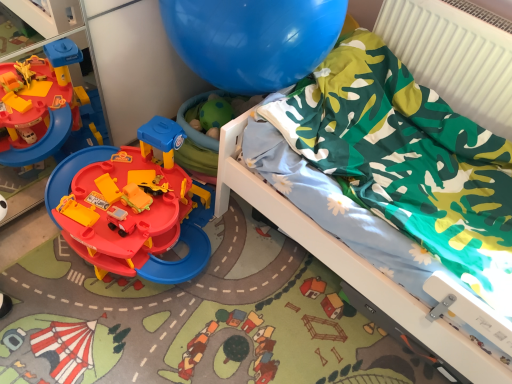
The image size is (512, 384). What do you see at coordinates (453, 58) in the screenshot?
I see `green fabric at upper right` at bounding box center [453, 58].

Image resolution: width=512 pixels, height=384 pixels. In order to click on green fabric at upper right in this screenshot , I will do coord(453,58).

Describe the element at coordinates (348, 262) in the screenshot. The height and width of the screenshot is (384, 512). I see `green camouflage fabric at upper right` at that location.

Measure the distance between green camouflage fabric at upper right and camera.

The depth of green camouflage fabric at upper right is 96.71 centimeters.

Locate an element on the screen. green camouflage fabric at upper right is located at coordinates (348, 262).

Where is `green fabric at upper right`? green fabric at upper right is located at coordinates (453, 58).

Which object is positioned more to the right, green camouflage fabric at upper right or green fabric at upper right?

green fabric at upper right is more to the right.

Which object is further away from the camera, green camouflage fabric at upper right or green fabric at upper right?

green fabric at upper right is more distant.

Considering the points (484, 376) and (429, 29), which point is in front, point (484, 376) or point (429, 29)?

The point (484, 376) is closer.

From the image's perspective, is green camouflage fabric at upper right beneath green fabric at upper right?

Yes, from the image's perspective, green camouflage fabric at upper right is beneath green fabric at upper right.

From a real-world perspective, is green camouflage fabric at upper right below green fabric at upper right?

Correct, in the physical world, green camouflage fabric at upper right is lower than green fabric at upper right.

Is green camouflage fabric at upper right wider than green fabric at upper right?

Correct, the width of green camouflage fabric at upper right exceeds that of green fabric at upper right.

From their relative heights in the image, would you say green camouflage fabric at upper right is taller or shorter than green fabric at upper right?

In the image, green camouflage fabric at upper right appears to be taller than green fabric at upper right.

Based on their sizes in the image, would you say green camouflage fabric at upper right is bigger or smaller than green fabric at upper right?

In the image, green camouflage fabric at upper right appears to be larger than green fabric at upper right.

Is green camouflage fabric at upper right situated inside green fabric at upper right or outside?

green camouflage fabric at upper right exists outside the volume of green fabric at upper right.

Is green camouflage fabric at upper right far away from green fabric at upper right?

No, there isn't a large distance between green camouflage fabric at upper right and green fabric at upper right.

Looking at this image, is green camouflage fabric at upper right oriented away from green fabric at upper right?

green camouflage fabric at upper right does not have its back to green fabric at upper right.

How different are the orientations of green camouflage fabric at upper right and green fabric at upper right in degrees?

The facing directions of green camouflage fabric at upper right and green fabric at upper right are 90 degrees apart.

How much distance is there between green camouflage fabric at upper right and green fabric at upper right?

28.84 inches.

The height and width of the screenshot is (384, 512). What are the coordinates of `radiator positioned vertically above the green camouflage fabric at upper right (from a real-world perspective)` in the screenshot? It's located at (453, 58).

Between green fabric at upper right and green camouflage fabric at upper right, which one appears on the left side from the viewer's perspective?

green camouflage fabric at upper right is more to the left.

In the image, is green fabric at upper right positioned in front of or behind green camouflage fabric at upper right?

Clearly, green fabric at upper right is behind green camouflage fabric at upper right.

Is point (510, 54) more distant than point (392, 281)?

Yes, point (510, 54) is farther from viewer.

From the image's perspective, does green fabric at upper right appear lower than green camouflage fabric at upper right?

No.

From a real-world perspective, who is located lower, green fabric at upper right or green camouflage fabric at upper right?

green camouflage fabric at upper right, from a real-world perspective.

Which object is wider, green fabric at upper right or green camouflage fabric at upper right?

green camouflage fabric at upper right is wider.

Based on the photo, can you confirm if green fabric at upper right is shorter than green camouflage fabric at upper right?

Yes, green fabric at upper right is shorter than green camouflage fabric at upper right.

Which of these two, green fabric at upper right or green camouflage fabric at upper right, is bigger?

green camouflage fabric at upper right.

Is green fabric at upper right completely or partially outside of green camouflage fabric at upper right?

That's correct, green fabric at upper right is outside of green camouflage fabric at upper right.

Is there a large distance between green fabric at upper right and green camouflage fabric at upper right?

green fabric at upper right is actually quite close to green camouflage fabric at upper right.

Is green fabric at upper right turned away from green camouflage fabric at upper right?

No.

Image resolution: width=512 pixels, height=384 pixels. Identify the location of bed located below the green fabric at upper right (from the image's perspective). (348, 262).

Where is `bed that appears below the green fabric at upper right (from a real-world perspective)`? This screenshot has width=512, height=384. bed that appears below the green fabric at upper right (from a real-world perspective) is located at coordinates (348, 262).

Find the location of a particular element. This screenshot has width=512, height=384. radiator behind the green camouflage fabric at upper right is located at coordinates (453, 58).